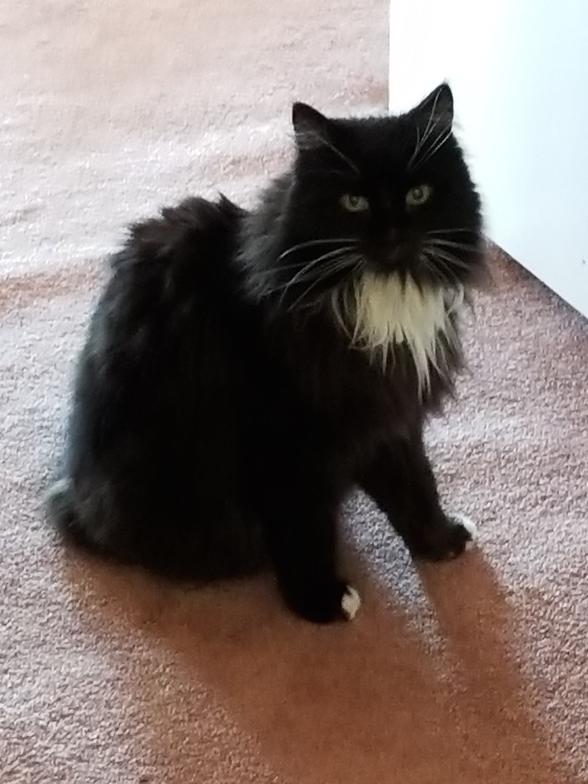
You are a GUI agent. You are given a task and a screenshot of the screen. Output one action in this format:
    pyautogui.click(x=<x>, y=<y>)
    Task: Click on the corner wall
    Image resolution: width=588 pixels, height=784 pixels.
    Given the screenshot: What is the action you would take?
    pyautogui.click(x=534, y=75)